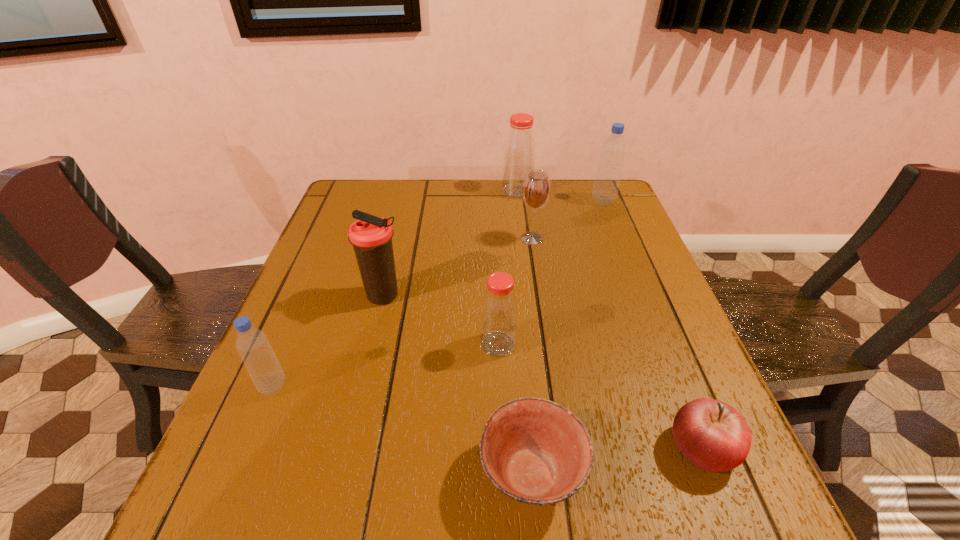
Identify the location of vacant region between the farther red bottle and the apple. (610, 320).

Locate an element on the screen. Image resolution: width=960 pixels, height=540 pixels. free space between the left blue bottle and the apple is located at coordinates (488, 417).

Locate an element on the screen. free space between the wineglass and the bigger blue bottle is located at coordinates (567, 220).

The height and width of the screenshot is (540, 960). Find the location of `object that is the seventh closest to the seventh object from right to left`. object that is the seventh closest to the seventh object from right to left is located at coordinates (606, 185).

Identify which object is located as the fifth nearest to the farther blue bottle. Please provide its 2D coordinates. Your answer should be formatted as a tuple, i.e. [(x, y)], where the tuple contains the x and y coordinates of a point satisfying the conditions above.

[(711, 434)]

Identify which bottle is located as the third nearest to the second nearest bottle. Please provide its 2D coordinates. Your answer should be formatted as a tuple, i.e. [(x, y)], where the tuple contains the x and y coordinates of a point satisfying the conditions above.

[(606, 185)]

Identify which bottle is located as the second nearest to the wineglass. Please provide its 2D coordinates. Your answer should be formatted as a tuple, i.e. [(x, y)], where the tuple contains the x and y coordinates of a point satisfying the conditions above.

[(606, 185)]